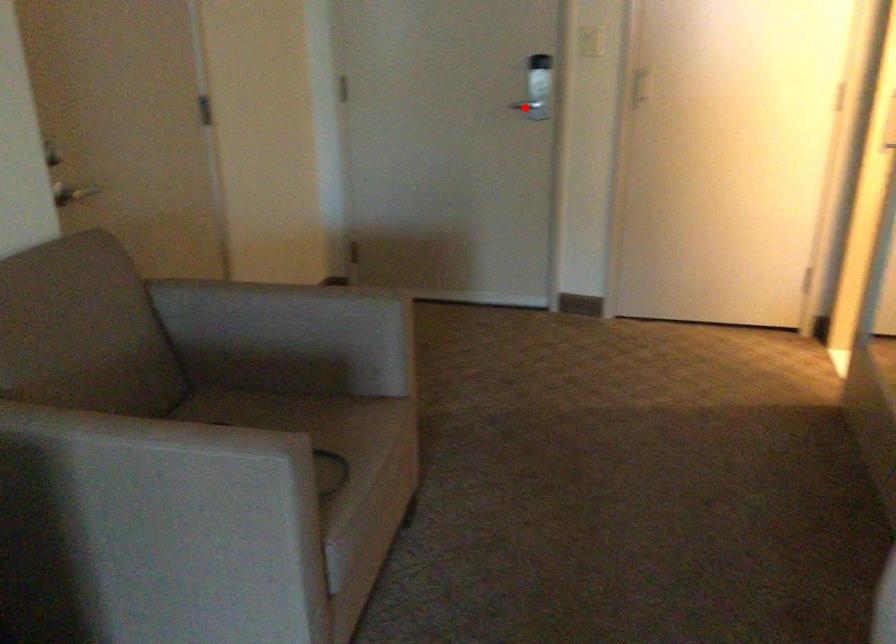
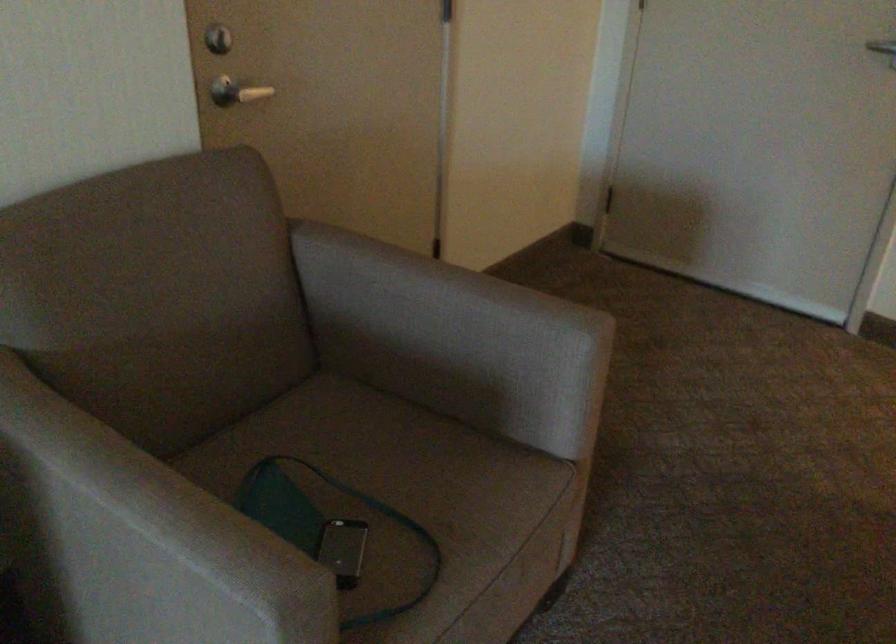
Locate, in the second image, the point that corresponds to the highlighted location in the first image.

(882, 46)